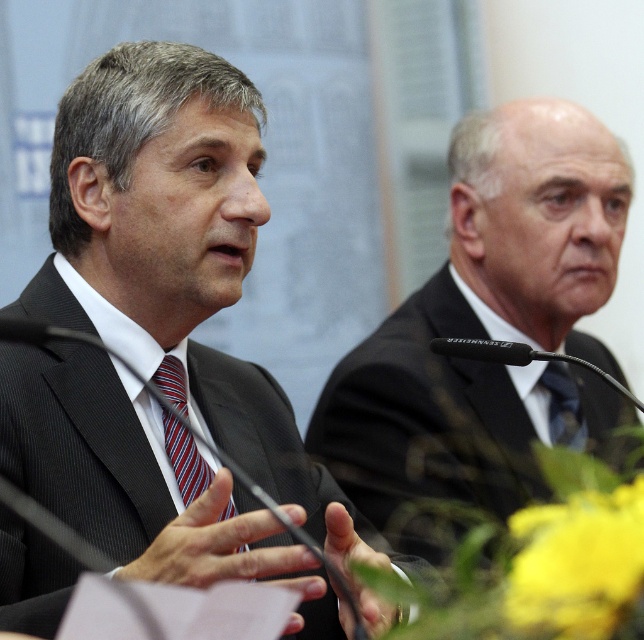
You are organizing a photo shoot and need to ensure that the black suit at right and the striped fabric tie at center are visible in the frame. Based on their positions and sizes, which object is more likely to be fully visible in a standard camera shot?

The black suit at right is wider than the striped fabric tie at center, so it is more likely to be fully visible in a standard camera shot because of its larger size.

You are organizing a photo shoot and need to ensure that all elements in the scene are properly framed. Given the description, which object should be placed higher in the composition to maintain visual balance between the black suit at right and the striped fabric tie at center?

The black suit at right is taller than the striped fabric tie at center, so to maintain visual balance, the striped fabric tie at center should be placed higher in the composition to compensate for its smaller size.